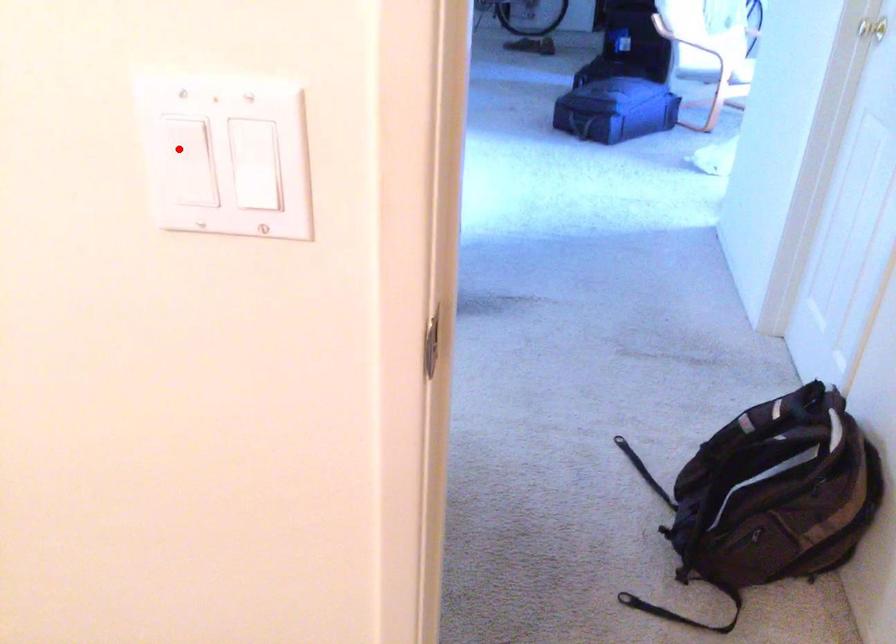
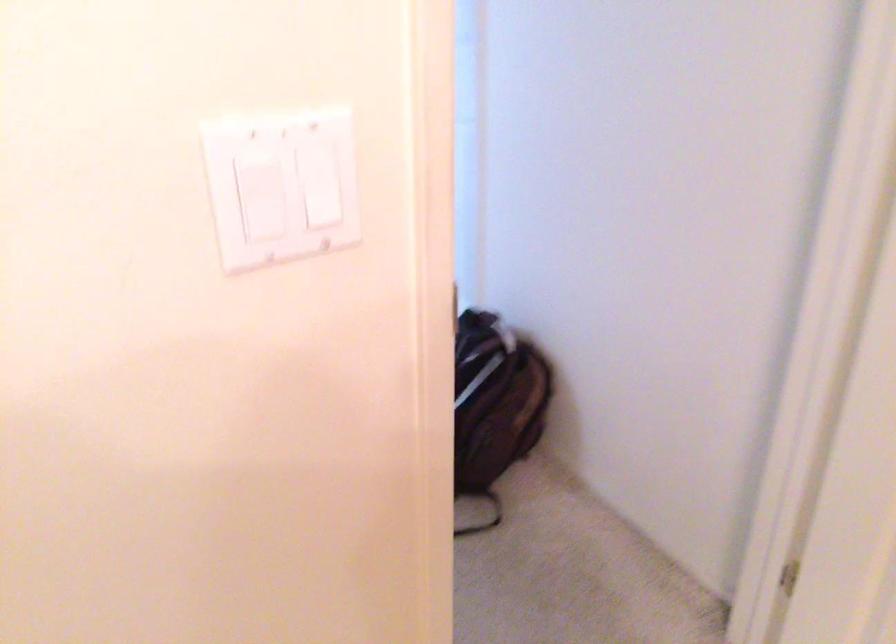
Where in the second image is the point corresponding to the highlighted location from the first image?

(260, 194)